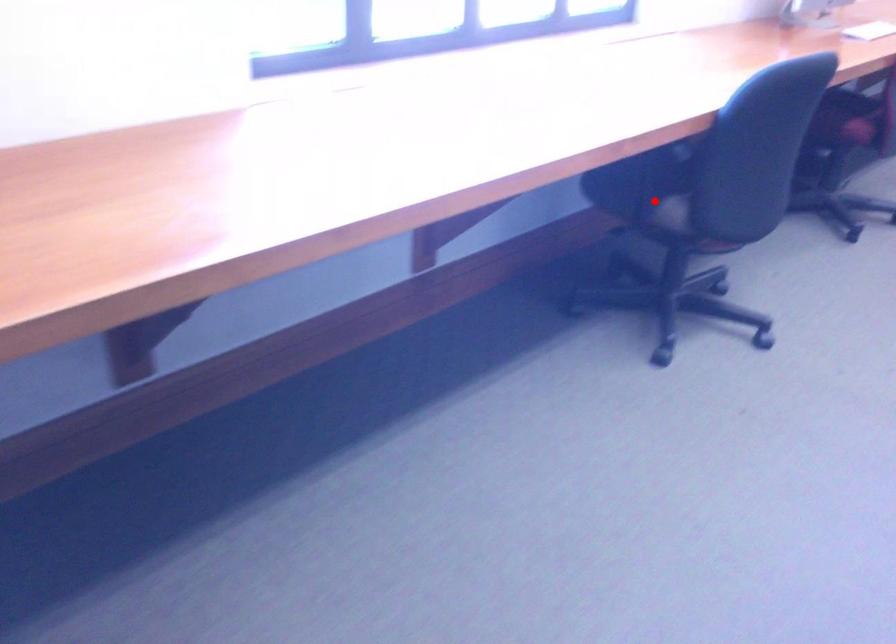
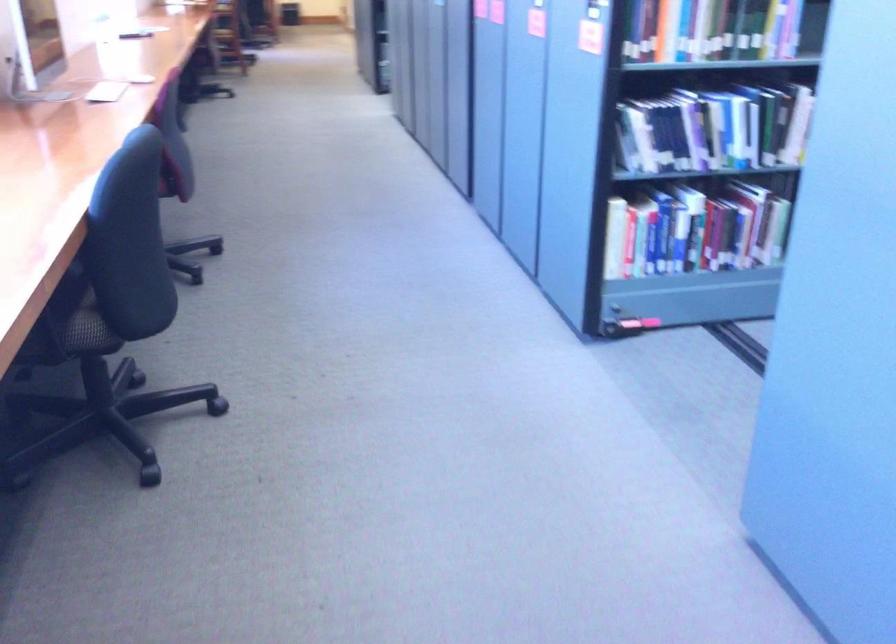
Where in the second image is the point corresponding to the highlighted location from the first image?

(73, 324)